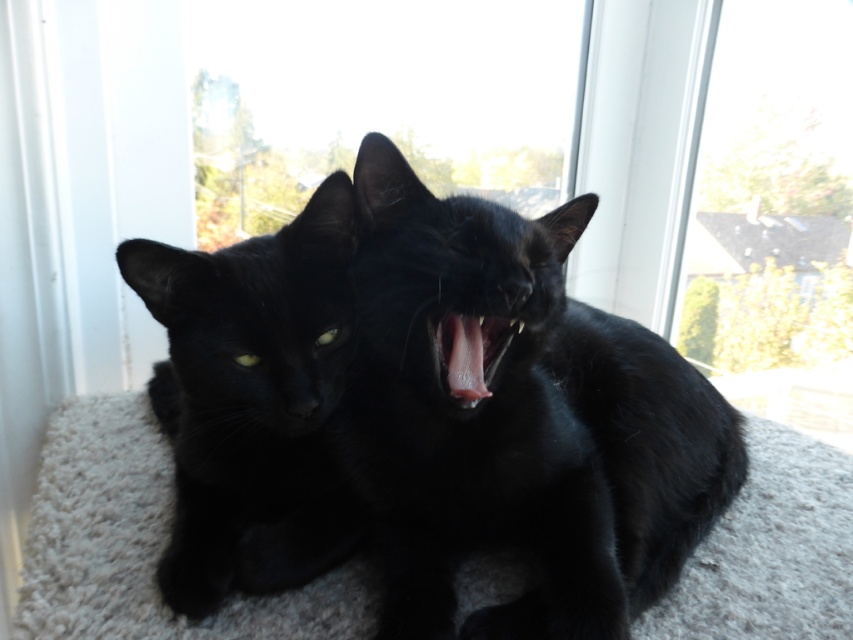
Question: Is white carpet at lower center wider than matte black cat at left?

Choices:
 (A) yes
 (B) no

Answer: (A)

Question: Which point is farther from the camera taking this photo?

Choices:
 (A) (791, 22)
 (B) (438, 321)
 (C) (218, 412)

Answer: (A)

Question: Which of the following is the farthest from the observer?

Choices:
 (A) (582, 400)
 (B) (845, 324)
 (C) (49, 540)

Answer: (B)

Question: Where is matte black cat at left located in relation to transparent glass window at upper right in the image?

Choices:
 (A) left
 (B) right

Answer: (A)

Question: Which of the following is the farthest from the observer?

Choices:
 (A) (822, 45)
 (B) (283, 445)
 (C) (140, 618)
 (D) (468, 381)

Answer: (A)

Question: Is black silky cat at center wider than transparent glass window at upper right?

Choices:
 (A) no
 (B) yes

Answer: (B)